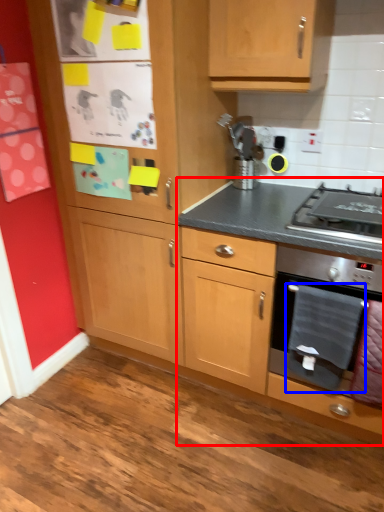
Question: Among these objects, which one is nearest to the camera, cabinetry (highlighted by a red box) or blanket (highlighted by a blue box)?

Choices:
 (A) cabinetry
 (B) blanket

Answer: (A)